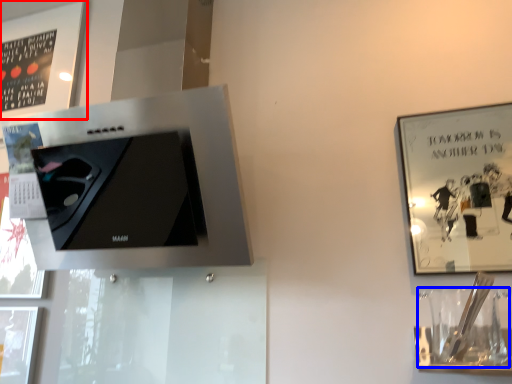
Question: Which object is further to the camera taking this photo, picture frame (highlighted by a red box) or wine glass (highlighted by a blue box)?

Choices:
 (A) picture frame
 (B) wine glass

Answer: (A)